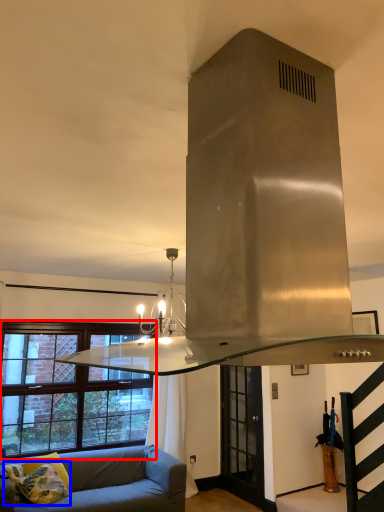
Question: Among these objects, which one is nearest to the camera, window (highlighted by a red box) or pillow (highlighted by a blue box)?

Choices:
 (A) window
 (B) pillow

Answer: (B)